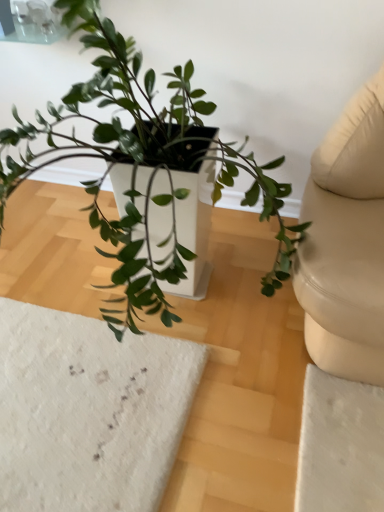
Question: Should I look upward or downward to see green matte plant at center?

Choices:
 (A) down
 (B) up

Answer: (B)